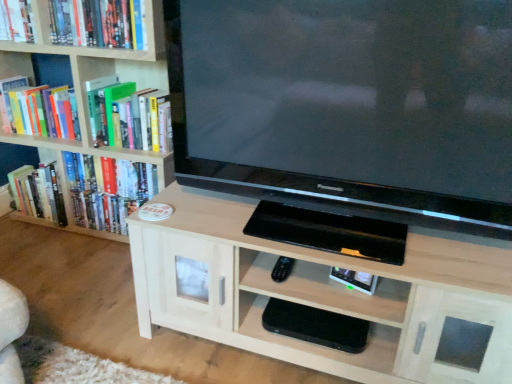
Question: Considering the relative sizes of hardcover book at upper left, positioned as the 3th book in top-to-bottom order, and hardcover book at upper left, acting as the 1th book starting from the top, in the image provided, is hardcover book at upper left, positioned as the 3th book in top-to-bottom order, shorter than hardcover book at upper left, acting as the 1th book starting from the top,?

Choices:
 (A) no
 (B) yes

Answer: (A)

Question: From a real-world perspective, is hardcover book at upper left, positioned as the 3th book in top-to-bottom order, physically above hardcover book at upper left, acting as the 1th book starting from the top?

Choices:
 (A) yes
 (B) no

Answer: (B)

Question: Is hardcover book at upper left, which ranks as the third book in bottom-to-top order, smaller than hardcover book at upper left, acting as the 1th book starting from the top?

Choices:
 (A) no
 (B) yes

Answer: (A)

Question: Does hardcover book at upper left, positioned as the 3th book in top-to-bottom order, lie in front of hardcover book at upper left, placed as the fifth book when sorted from bottom to top?

Choices:
 (A) no
 (B) yes

Answer: (A)

Question: Is hardcover book at upper left, positioned as the 3th book in top-to-bottom order, aimed at hardcover book at upper left, placed as the fifth book when sorted from bottom to top?

Choices:
 (A) no
 (B) yes

Answer: (A)

Question: Is hardcover book at left, placed as the fifth book when sorted from top to bottom, inside or outside of light wood cabinet at center, arranged as the first shelf when viewed from the top?

Choices:
 (A) outside
 (B) inside

Answer: (A)

Question: Is point (24, 188) closer or farther from the camera than point (373, 344)?

Choices:
 (A) farther
 (B) closer

Answer: (A)

Question: Relative to light wood cabinet at center, arranged as the first shelf when viewed from the top, is hardcover book at left, placed as the fifth book when sorted from top to bottom, in front or behind?

Choices:
 (A) behind
 (B) front

Answer: (A)

Question: From a real-world perspective, is hardcover book at left, which appears as the 1th book when ordered from the bottom, above or below light wood cabinet at center, arranged as the first shelf when viewed from the top?

Choices:
 (A) below
 (B) above

Answer: (A)

Question: Would you say hardcover book at upper left, placed as the fifth book when sorted from bottom to top, is to the left or to the right of hardcover book at left, placed as the fifth book when sorted from top to bottom, in the picture?

Choices:
 (A) right
 (B) left

Answer: (A)

Question: From their relative heights in the image, would you say hardcover book at upper left, placed as the fifth book when sorted from bottom to top, is taller or shorter than hardcover book at left, which appears as the 1th book when ordered from the bottom?

Choices:
 (A) short
 (B) tall

Answer: (A)

Question: Based on their sizes in the image, would you say hardcover book at upper left, placed as the fifth book when sorted from bottom to top, is bigger or smaller than hardcover book at left, placed as the fifth book when sorted from top to bottom?

Choices:
 (A) small
 (B) big

Answer: (A)

Question: Considering the positions of point (24, 18) and point (30, 192), is point (24, 18) closer or farther from the camera than point (30, 192)?

Choices:
 (A) closer
 (B) farther

Answer: (A)

Question: In the image, is wooden bookcase at left on the left side or the right side of hardcover book at upper left, which is the fourth book from bottom to top?

Choices:
 (A) right
 (B) left

Answer: (B)

Question: Would you say wooden bookcase at left is inside or outside hardcover book at upper left, the 2th book positioned from the top?

Choices:
 (A) inside
 (B) outside

Answer: (B)